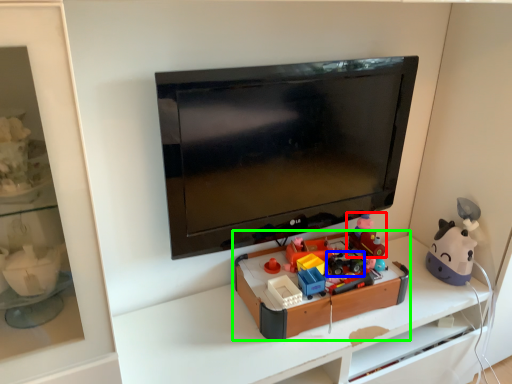
Question: Which object is positioned farthest from toy (highlighted by a red box)? Select from toy (highlighted by a blue box) and toy (highlighted by a green box).

Choices:
 (A) toy
 (B) toy

Answer: (B)